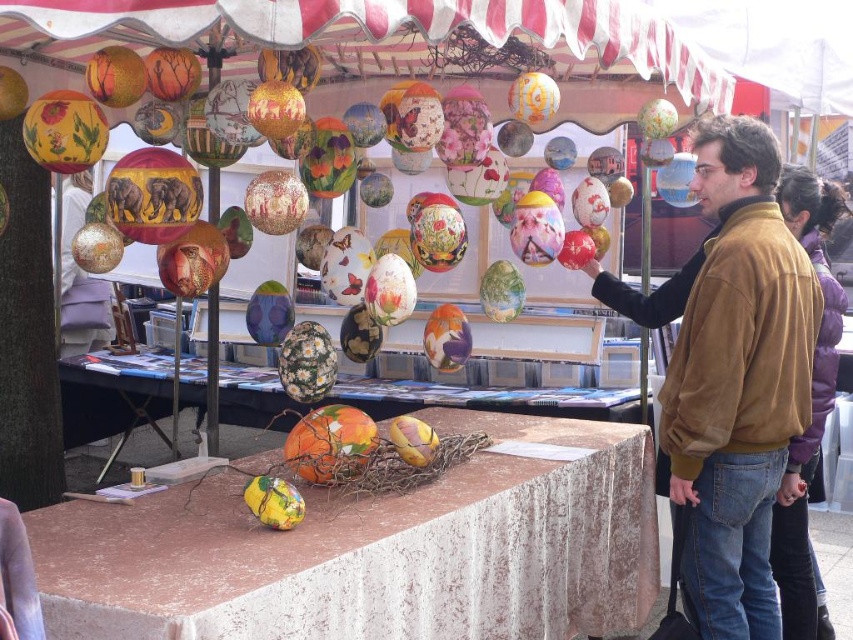
You are at the market stall and want to reach both the point at coordinates point (x=129, y=556) and the point at coordinates point (x=780, y=586). Which point should you approach first to reach the one closer to you?

You should approach point (x=129, y=556) first because it is closer to you than point 0.916, 0.916.